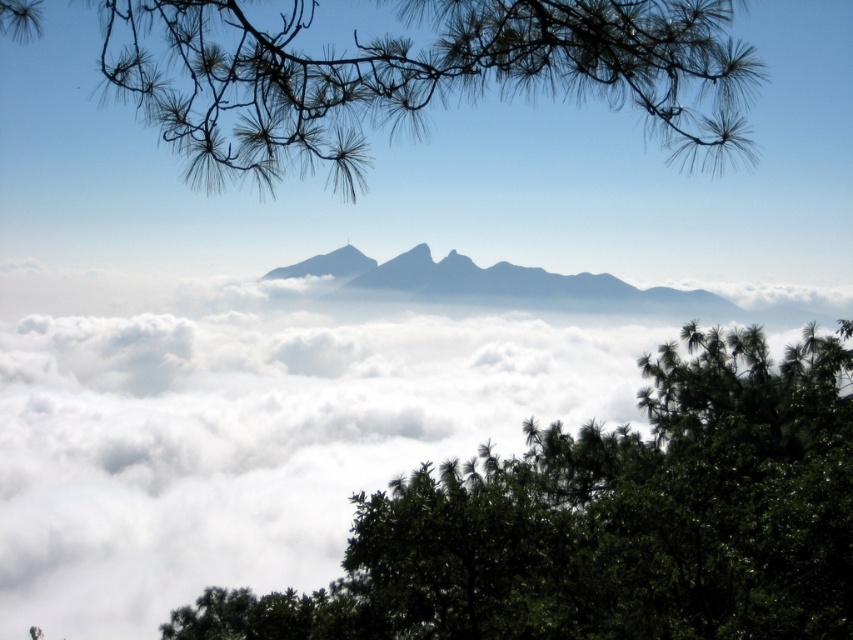
You are an observer standing in the mountain landscape described. You notice the dark green leafy tree at center and the gray rocky peak at center. Which object appears taller in the scene?

The dark green leafy tree at center is much taller than the gray rocky peak at center, so the dark green leafy tree at center appears taller in the scene.